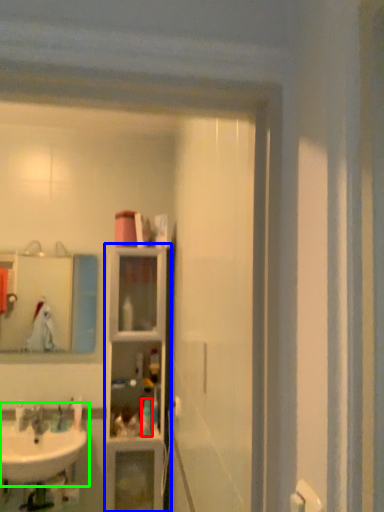
Question: Estimate the real-world distances between objects in this image. Which object is farther from toiletry (highlighted by a red box), closet (highlighted by a blue box) or sink (highlighted by a green box)?

Choices:
 (A) closet
 (B) sink

Answer: (B)